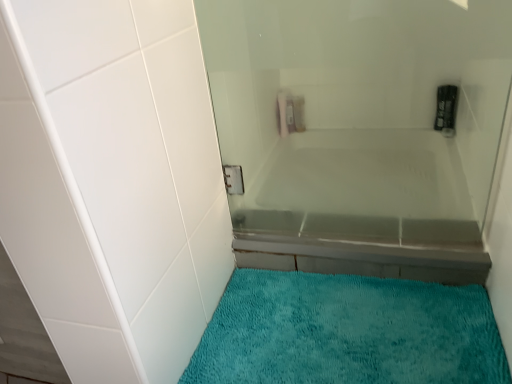
Question: From the image's perspective, relative to teal plush bath mat at lower center, is white glossy bathtub at center above or below?

Choices:
 (A) above
 (B) below

Answer: (A)

Question: Considering the positions of point (283, 253) and point (372, 359), is point (283, 253) closer or farther from the camera than point (372, 359)?

Choices:
 (A) closer
 (B) farther

Answer: (B)

Question: In terms of height, does white glossy bathtub at center look taller or shorter compared to teal plush bath mat at lower center?

Choices:
 (A) tall
 (B) short

Answer: (A)

Question: Is teal plush bath mat at lower center to the left or to the right of white glossy bathtub at center in the image?

Choices:
 (A) right
 (B) left

Answer: (B)

Question: Is teal plush bath mat at lower center bigger or smaller than white glossy bathtub at center?

Choices:
 (A) big
 (B) small

Answer: (B)

Question: Does point (306, 279) appear closer or farther from the camera than point (304, 238)?

Choices:
 (A) closer
 (B) farther

Answer: (A)

Question: From a real-world perspective, is teal plush bath mat at lower center physically located above or below white glossy bathtub at center?

Choices:
 (A) above
 (B) below

Answer: (B)